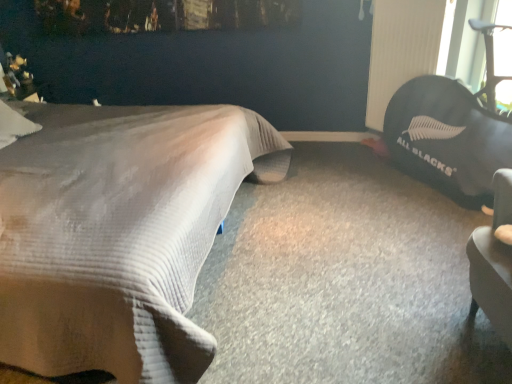
Question: Would you say black rubber radiator at upper right is part of black fabric bean bag at right's contents?

Choices:
 (A) no
 (B) yes

Answer: (A)

Question: From a real-world perspective, does black fabric bean bag at right stand above black rubber radiator at upper right?

Choices:
 (A) yes
 (B) no

Answer: (B)

Question: Is black fabric bean bag at right next to black rubber radiator at upper right?

Choices:
 (A) no
 (B) yes

Answer: (A)

Question: Considering the relative sizes of black fabric bean bag at right and black rubber radiator at upper right in the image provided, is black fabric bean bag at right shorter than black rubber radiator at upper right?

Choices:
 (A) yes
 (B) no

Answer: (B)

Question: Is black fabric bean bag at right closer to the viewer compared to black rubber radiator at upper right?

Choices:
 (A) no
 (B) yes

Answer: (B)

Question: Is black fabric bean bag at right thinner than black rubber radiator at upper right?

Choices:
 (A) yes
 (B) no

Answer: (B)

Question: Can you confirm if black rubber radiator at upper right is thinner than black fabric bean bag at right?

Choices:
 (A) no
 (B) yes

Answer: (B)

Question: From the image's perspective, is black rubber radiator at upper right located beneath black fabric bean bag at right?

Choices:
 (A) no
 (B) yes

Answer: (A)

Question: Can you confirm if black rubber radiator at upper right is smaller than black fabric bean bag at right?

Choices:
 (A) yes
 (B) no

Answer: (A)

Question: Considering the relative sizes of black rubber radiator at upper right and black fabric bean bag at right in the image provided, is black rubber radiator at upper right bigger than black fabric bean bag at right?

Choices:
 (A) yes
 (B) no

Answer: (B)

Question: Is black rubber radiator at upper right facing towards black fabric bean bag at right?

Choices:
 (A) yes
 (B) no

Answer: (A)

Question: Are black rubber radiator at upper right and black fabric bean bag at right beside each other?

Choices:
 (A) yes
 (B) no

Answer: (B)

Question: Is beige textured bed at left surrounded by black rubber radiator at upper right?

Choices:
 (A) no
 (B) yes

Answer: (A)